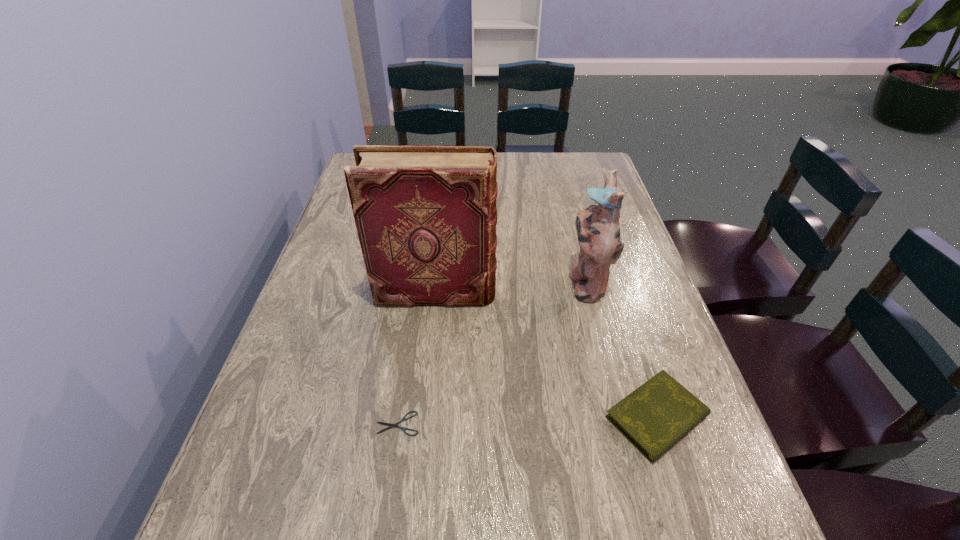
Locate an element on the screen. This screenshot has height=540, width=960. free space that satisfies the following two spatial constraints: 1. on the front-facing side of the figurine; 2. on the left side of the second shortest object is located at coordinates (619, 416).

The image size is (960, 540). In order to click on free spot that satisfies the following two spatial constraints: 1. on the front-facing side of the third tallest object; 2. on the left side of the figurine in this screenshot , I will do `click(619, 416)`.

Locate an element on the screen. The width and height of the screenshot is (960, 540). vacant space that satisfies the following two spatial constraints: 1. on the front-facing side of the figurine; 2. on the right side of the diary is located at coordinates (619, 416).

The width and height of the screenshot is (960, 540). Identify the location of vacant space that satisfies the following two spatial constraints: 1. on the spine side of the tallest object; 2. on the back side of the diary. (423, 416).

The height and width of the screenshot is (540, 960). Find the location of `free space that satisfies the following two spatial constraints: 1. on the front-facing side of the third shortest object; 2. on the front side of the shears`. free space that satisfies the following two spatial constraints: 1. on the front-facing side of the third shortest object; 2. on the front side of the shears is located at coordinates (621, 423).

Locate an element on the screen. vacant area that satisfies the following two spatial constraints: 1. on the spine side of the hardback book; 2. on the right side of the diary is located at coordinates (423, 416).